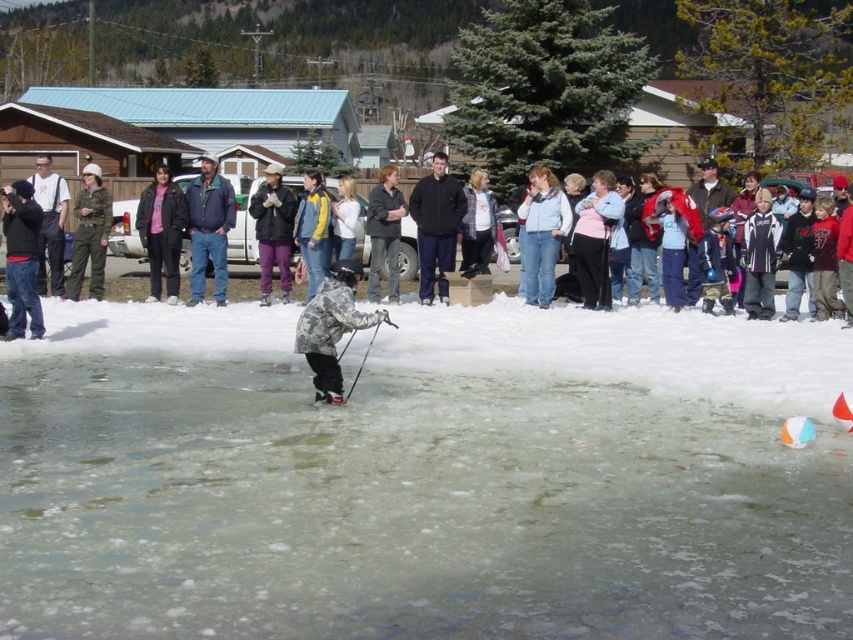
The height and width of the screenshot is (640, 853). What do you see at coordinates (161, 232) in the screenshot?
I see `matte black jacket at center` at bounding box center [161, 232].

In order to click on matte black jacket at center in this screenshot , I will do `click(161, 232)`.

Between point (169, 184) and point (51, 292), which one is positioned behind?

The point (51, 292) is behind.

Find the location of `matte black jacket at center`. matte black jacket at center is located at coordinates pyautogui.click(x=161, y=232).

Which is in front, point (76, 250) or point (381, 195)?

Positioned in front is point (381, 195).

This screenshot has width=853, height=640. Identify the location of camouflage fabric jacket at center. (90, 234).

Locate an element on the screen. This screenshot has height=640, width=853. camouflage fabric jacket at center is located at coordinates (90, 234).

Between translucent ice rink at center and dark gray camouflage jacket at left, which one has less height?

translucent ice rink at center

What do you see at coordinates (424, 477) in the screenshot? I see `translucent ice rink at center` at bounding box center [424, 477].

Does point (485, 570) come in front of point (49, 208)?

That is True.

Identify the location of translucent ice rink at center. This screenshot has width=853, height=640. (424, 477).